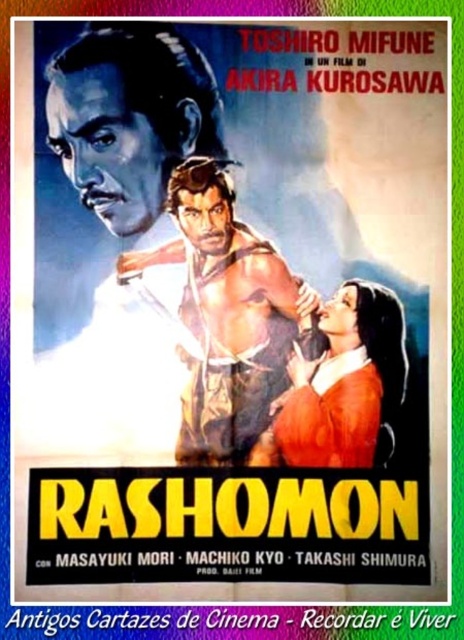
Question: Can you confirm if muscular skin warrior at center is positioned below smooth orange dress at center?

Choices:
 (A) yes
 (B) no

Answer: (B)

Question: Can you confirm if muscular skin warrior at center is smaller than smooth orange dress at center?

Choices:
 (A) no
 (B) yes

Answer: (A)

Question: Among these points, which one is nearest to the camera?

Choices:
 (A) tap(333, 321)
 (B) tap(250, 413)

Answer: (B)

Question: Which of the following is the closest to the observer?

Choices:
 (A) (173, 248)
 (B) (365, 310)

Answer: (B)

Question: Among these objects, which one is nearest to the camera?

Choices:
 (A) muscular skin warrior at center
 (B) smooth orange dress at center

Answer: (B)

Question: Is muscular skin warrior at center closer to camera compared to smooth orange dress at center?

Choices:
 (A) yes
 (B) no

Answer: (B)